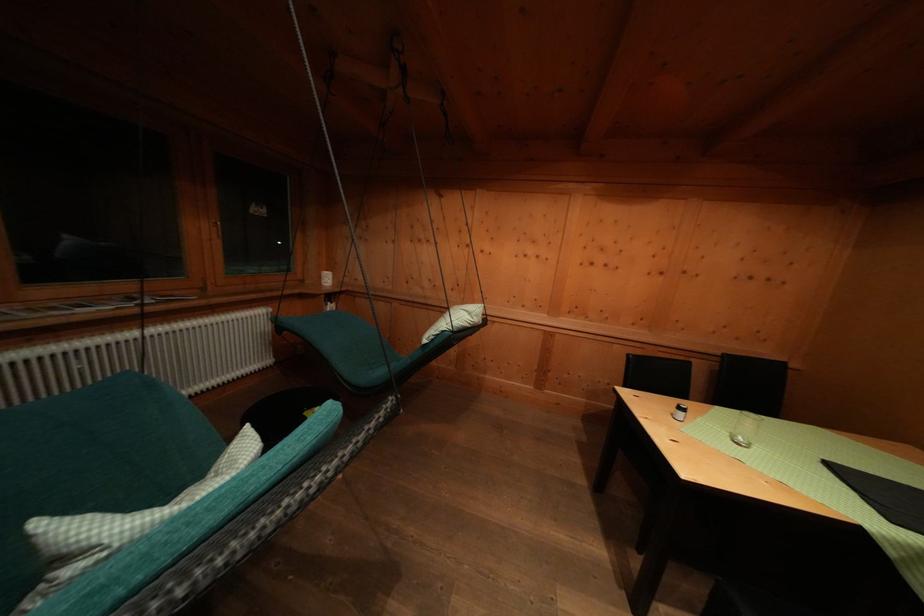
Where is `green chair sitting surface`? This screenshot has height=616, width=924. green chair sitting surface is located at coordinates (337, 336).